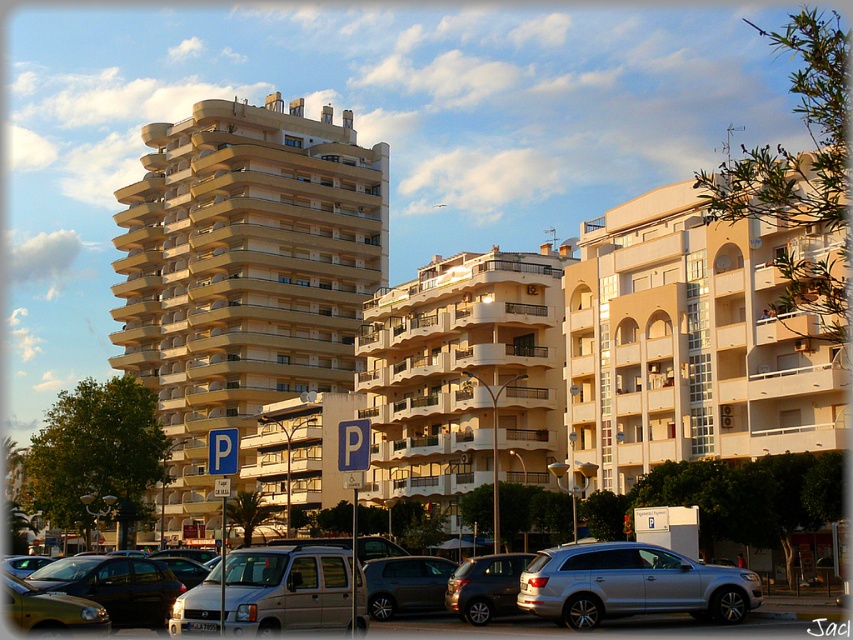
From the picture: You are a delivery driver who needs to park your truck between the silver metallic suv at center and the matte silver suv at center. Can you fit your truck that is 2 meters wide into the space between them?

The silver metallic suv at center is positioned on the left side of matte silver suv at center. However, the exact width between them isn not provided in the objects description, so it is impossible to determine if the truck can fit.

You are a delivery driver who needs to park your silver metallic suv at center in a spot that can accommodate its height. The beige concrete building at center is nearby. Based on the scene, is the suv likely too tall to fit under the building? Explain your reasoning.

The beige concrete building at center has a greater height compared to the silver metallic suv at center. Since the building is taller than the SUV, the SUV is unlikely to be too tall to fit under it. However, the actual clearance depends on the specific structure of the building, such as overhangs or low entryways, which aren

You are standing at the point labeled as point (637, 582) in the image. What object are you currently standing on?

The point (637, 582) is located on the silver metallic suv at center.